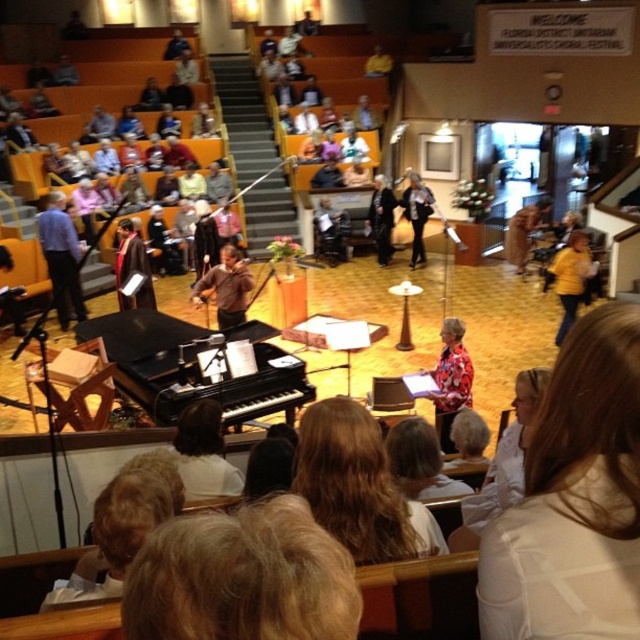
You are an usher at the event and need to guide someone to the stage. The path to the stage is blocked by the black polished piano at center and the blonde hair at center. Which object should you move first to clear the path?

The black polished piano at center is located above blonde hair at center, so you should move the blonde hair at center first to clear the path.

You are sitting in the audience and want to focus on both the black polished piano at center and the matte blue shirt at left. Which object should you look towards first if you are facing the stage and want to glance from left to right?

You should first look at the matte blue shirt at left because it is positioned to the left of the black polished piano at center, so when glancing from left to right, you would start with the matte blue shirt at left and then move to the black polished piano at center.